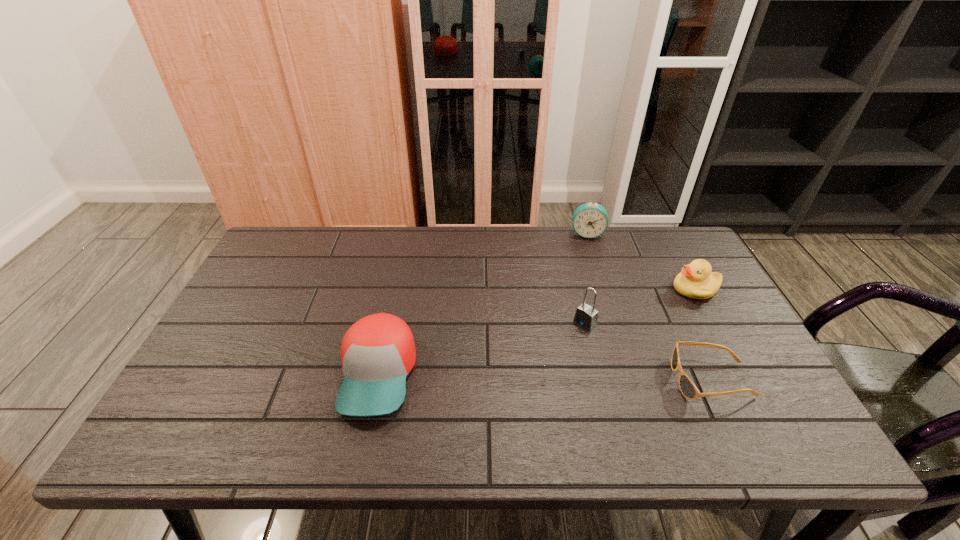
You are a GUI agent. You are given a task and a screenshot of the screen. Output one action in this format:
    pyautogui.click(x=<x>, y=<y>)
    Task: Click on the free space between the sunglasses and the fourth nearest object
    Image resolution: width=960 pixels, height=540 pixels.
    Given the screenshot: What is the action you would take?
    pyautogui.click(x=704, y=334)

At what (x,y) coordinates should I click in order to perform the action: click on vacant point located between the padlock and the sunglasses. Please return your answer as a coordinate pair (x, y). The height and width of the screenshot is (540, 960). Looking at the image, I should click on (648, 352).

The image size is (960, 540). I want to click on unoccupied area between the leftmost object and the second farthest object, so click(537, 331).

You are a GUI agent. You are given a task and a screenshot of the screen. Output one action in this format:
    pyautogui.click(x=<x>, y=<y>)
    Task: Click on the vacant area between the baseball cap and the padlock
    The height and width of the screenshot is (540, 960).
    Given the screenshot: What is the action you would take?
    pyautogui.click(x=482, y=348)

At what (x,y) coordinates should I click in order to perform the action: click on free spot between the alarm clock and the leftmost object. Please return your answer as a coordinate pair (x, y). The width and height of the screenshot is (960, 540). Looking at the image, I should click on pyautogui.click(x=483, y=303).

Image resolution: width=960 pixels, height=540 pixels. Find the location of `empty space that is in between the leftmost object and the padlock`. empty space that is in between the leftmost object and the padlock is located at coordinates (482, 348).

I want to click on vacant space in between the duckling and the farthest object, so click(x=641, y=261).

In order to click on object that is the second closest to the duckling in this screenshot , I will do `click(589, 220)`.

Choose which object is the nearest neighbor to the farthest object. Please provide its 2D coordinates. Your answer should be formatted as a tuple, i.e. [(x, y)], where the tuple contains the x and y coordinates of a point satisfying the conditions above.

[(696, 281)]

At what (x,y) coordinates should I click in order to perform the action: click on free location that satisfies the following two spatial constraints: 1. at the brim of the shortest object; 2. on the front-facing side of the leftmost object. Please return your answer as a coordinate pair (x, y). Looking at the image, I should click on (377, 380).